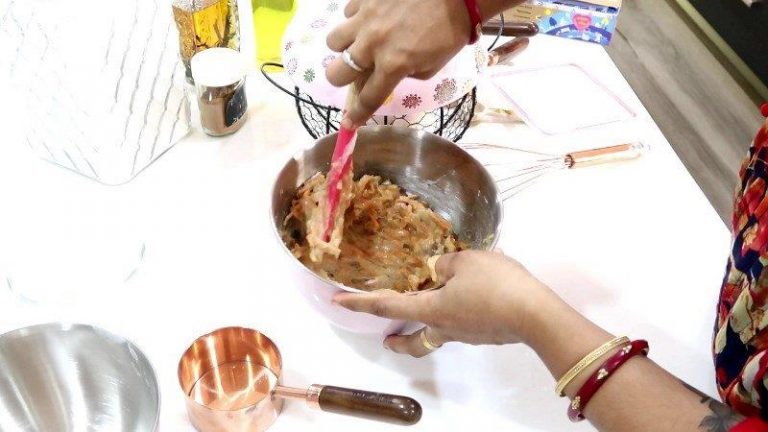
The width and height of the screenshot is (768, 432). Identify the location of white kitchen counter top. (216, 241).